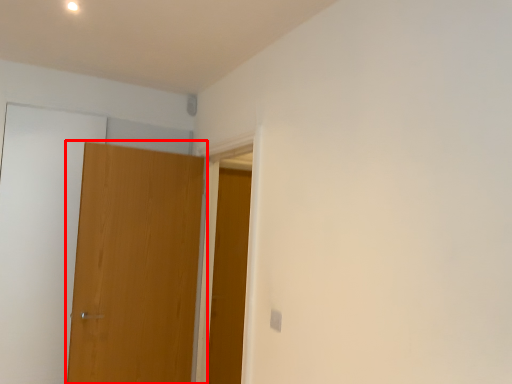
Question: From the image's perspective, where is door (annotated by the red box) located relative to door?

Choices:
 (A) below
 (B) above

Answer: (B)